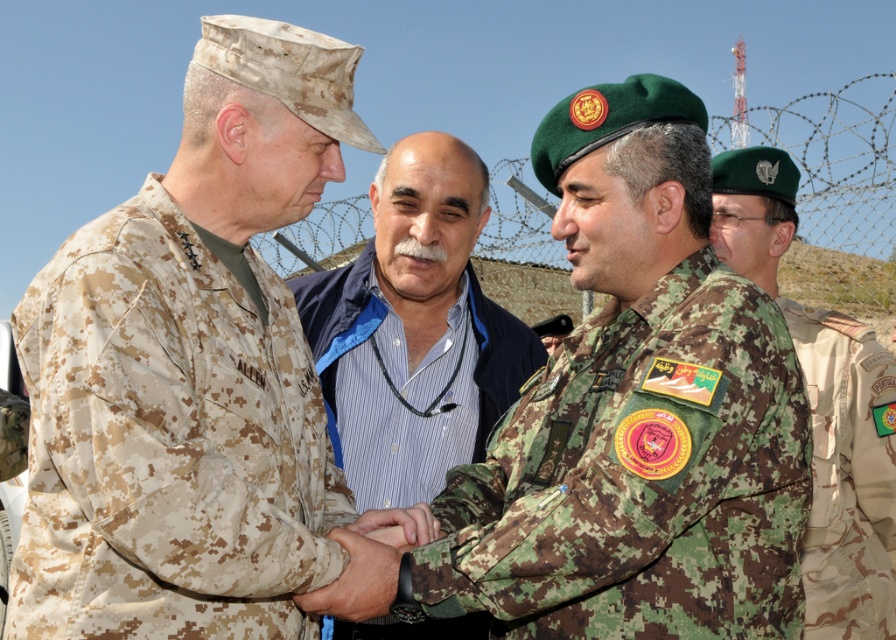
Consider the image. You are a photographer positioned at the camera location. You want to capture a closeup shot of the camouflage fabric uniform at center. Given that your telephoto lens has a minimum focusing distance of 10 meters, can you use it to take the photo?

The camouflage fabric uniform at center is 20.50 meters away from the camera. Since the telephoto lens can focus at 10 meters and beyond, you can use it to take the photo.

You are an observer at the scene. You notice two individuals wearing different clothing. The first is wearing a blue striped shirt at center and the second is wearing a camouflage fabric uniform at right. Which of these two is taller?

The blue striped shirt at center is much taller than the camouflage fabric uniform at right according to the description provided.